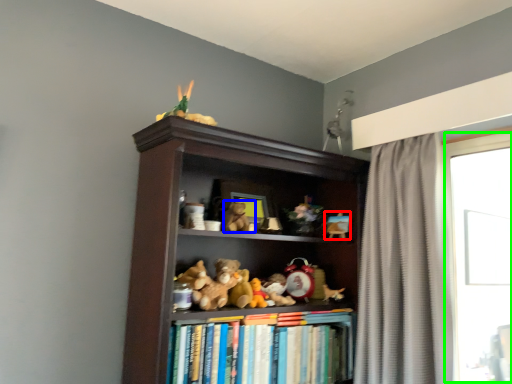
Question: Which is farther away from toy (highlighted by a red box)? animal (highlighted by a blue box) or window (highlighted by a green box)?

Choices:
 (A) animal
 (B) window

Answer: (B)